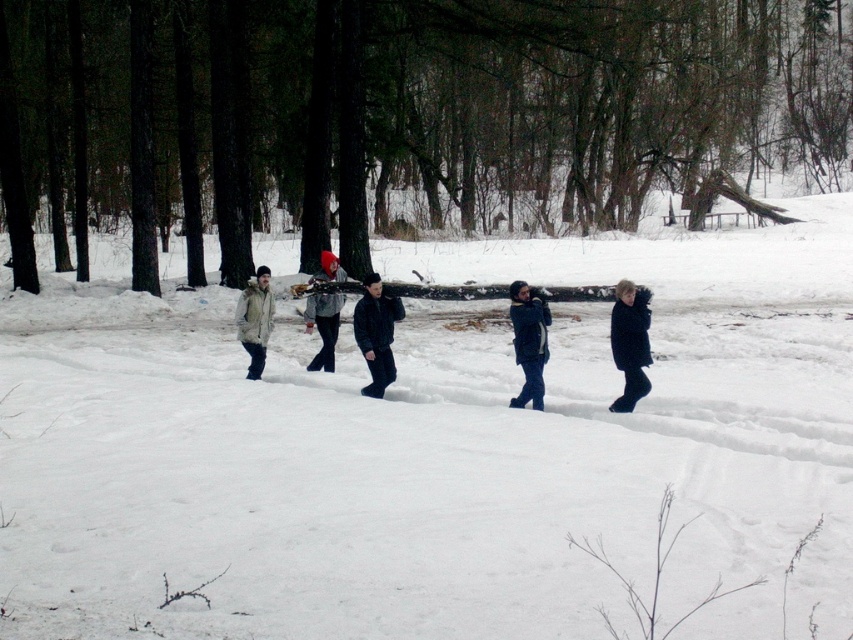
You are planning to place a 2.5 meters long ladder between the black matte jacket at center and the light beige jacket at left. Will the ladder fit between them without bending?

The distance between the black matte jacket at center and the light beige jacket at left is 2.12 meters. Since the ladder is 2.5 meters long, it will not fit between them without bending.

You are planning to take a photo of the dark blue coat at right and the black matte jacket at center in the snowy forest scene. Which of the two clothing items appears narrower in the image?

The dark blue coat at right appears narrower than the black matte jacket at center in the image.